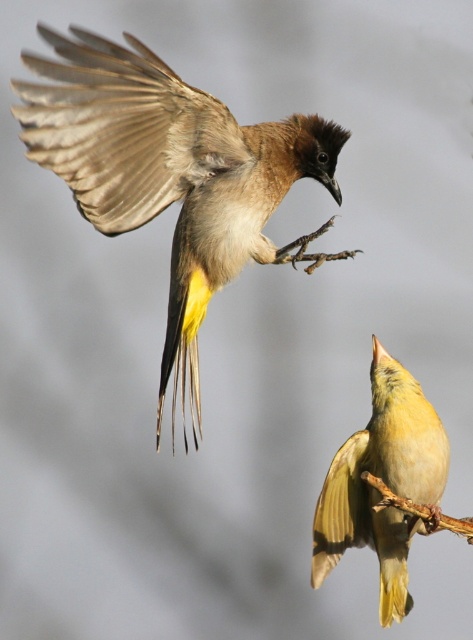
Is point (62, 74) positioned after point (330, 536)?

No, (62, 74) is closer to viewer.

The height and width of the screenshot is (640, 473). What are the coordinates of `brown feathered bird at upper left` in the screenshot? It's located at (172, 173).